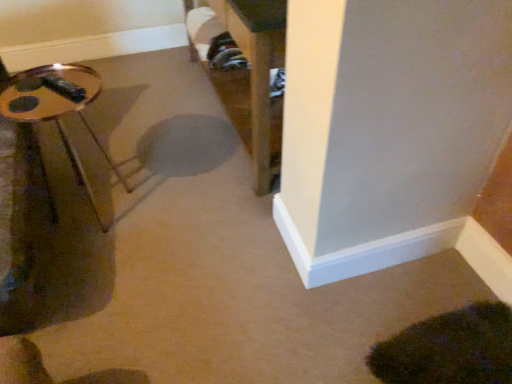
The height and width of the screenshot is (384, 512). Identify the location of vacant space underneath metallic glass table at left (from a real-world perspective). (95, 207).